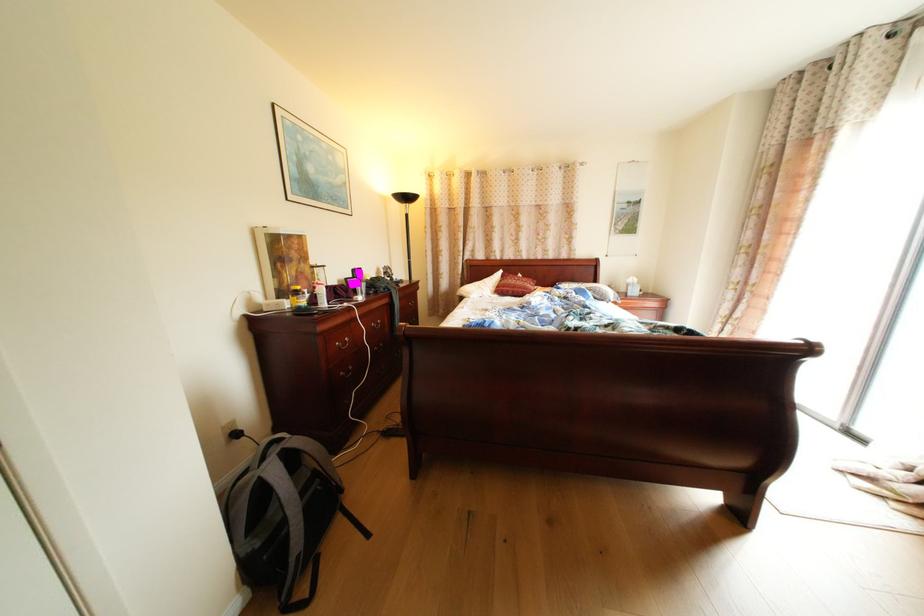
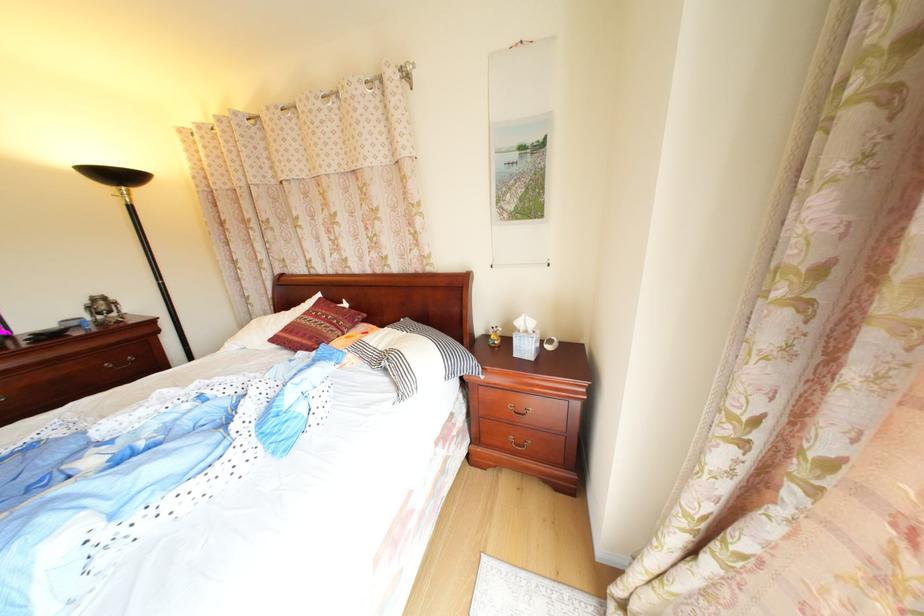
Where in the second image is the point corresponding to (570,285) from the first image?

(415, 322)